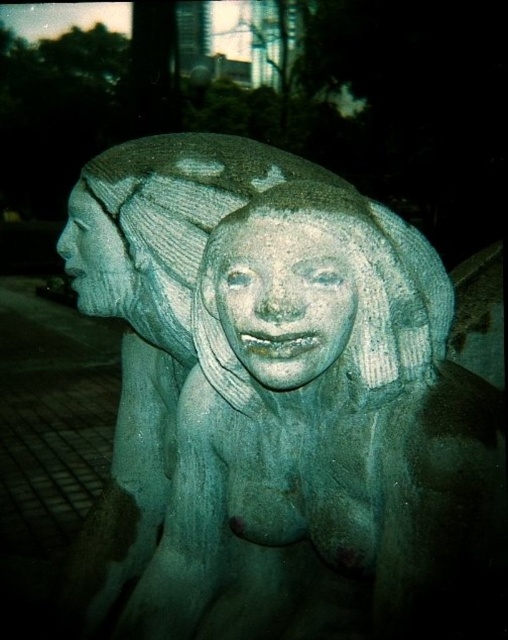
Question: Does green stone statue at center appear on the left side of slate stone face at center?

Choices:
 (A) yes
 (B) no

Answer: (A)

Question: Which point appears closest to the camera in this image?

Choices:
 (A) (110, 305)
 (B) (340, 323)
 (C) (416, 520)

Answer: (B)

Question: Which point is closer to the camera taking this photo?

Choices:
 (A) (109, 288)
 (B) (241, 301)
 (C) (150, 193)

Answer: (B)

Question: Which of the following is the farthest from the observer?

Choices:
 (A) matte stone face at center
 (B) green stone statue at center
 (C) slate stone face at center

Answer: (A)

Question: Is green stone statue at center further to camera compared to matte stone face at center?

Choices:
 (A) yes
 (B) no

Answer: (B)

Question: Can you confirm if green stone statue at center is bigger than matte stone face at center?

Choices:
 (A) yes
 (B) no

Answer: (A)